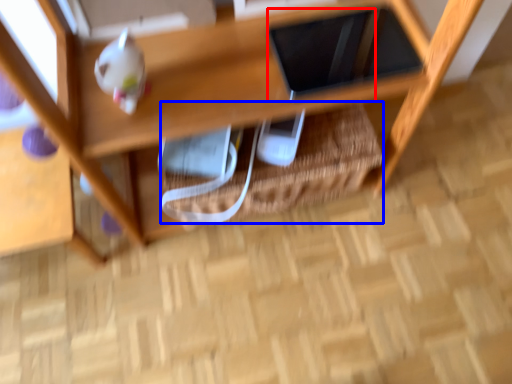
Question: Among these objects, which one is nearest to the camera, tablet computer (highlighted by a red box) or basket (highlighted by a blue box)?

Choices:
 (A) tablet computer
 (B) basket

Answer: (A)